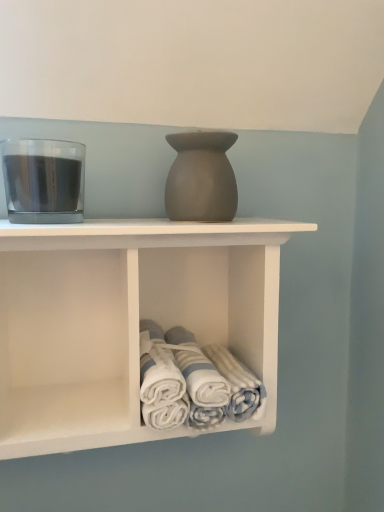
The image size is (384, 512). Describe the element at coordinates (201, 177) in the screenshot. I see `matte gray vase at center` at that location.

At what (x,y) coordinates should I click in order to perform the action: click on matte gray vase at center. Please return your answer as a coordinate pair (x, y). The image size is (384, 512). Looking at the image, I should click on (201, 177).

Measure the distance between transparent glass at left and camera.

A distance of 17.96 inches exists between transparent glass at left and camera.

The width and height of the screenshot is (384, 512). In order to click on matte gray vase at center in this screenshot , I will do `click(201, 177)`.

Are white matte towel rack at center and matte gray vase at center making contact?

They are not placed beside each other.

Is white matte towel rack at center outside of matte gray vase at center?

Yes.

Based on the photo, considering the sizes of white matte towel rack at center and matte gray vase at center in the image, is white matte towel rack at center wider or thinner than matte gray vase at center?

white matte towel rack at center is wider than matte gray vase at center.

From the picture: Is white matte towel rack at center in front of or behind matte gray vase at center in the image?

Visually, white matte towel rack at center is located in front of matte gray vase at center.

Considering the sizes of objects matte gray vase at center and transparent glass at left in the image provided, who is smaller, matte gray vase at center or transparent glass at left?

Smaller between the two is matte gray vase at center.

Between matte gray vase at center and transparent glass at left, which one has larger width?

Wider between the two is transparent glass at left.

Can you confirm if matte gray vase at center is positioned to the left of transparent glass at left?

No, matte gray vase at center is not to the left of transparent glass at left.

Considering the relative positions of white cotton towels at lower center and transparent glass at left in the image provided, is white cotton towels at lower center to the left or to the right of transparent glass at left?

Based on their positions, white cotton towels at lower center is located to the right of transparent glass at left.

In terms of height, does white cotton towels at lower center look taller or shorter compared to transparent glass at left?

In the image, white cotton towels at lower center appears to be shorter than transparent glass at left.

Is white cotton towels at lower center inside or outside of transparent glass at left?

white cotton towels at lower center is spatially situated outside transparent glass at left.

What's the angular difference between white cotton towels at lower center and matte gray vase at center's facing directions?

The angle between the facing direction of white cotton towels at lower center and the facing direction of matte gray vase at center is 1.5 degrees.

Is white cotton towels at lower center spatially inside matte gray vase at center, or outside of it?

The correct answer is: outside.

Is white cotton towels at lower center aimed at matte gray vase at center?

No, white cotton towels at lower center is not aimed at matte gray vase at center.

In the scene shown: From a real-world perspective, between white cotton towels at lower center and matte gray vase at center, who is vertically higher?

matte gray vase at center is physically above.

Looking at this image, could you tell me if white matte towel rack at center is facing transparent glass at left?

No, white matte towel rack at center does not turn towards transparent glass at left.

Find the location of a particular element. The image size is (384, 512). shelf in front of the transparent glass at left is located at coordinates (126, 321).

Which point is more forward, (274,314) or (58,186)?

Point (58,186)

Considering the sizes of objects white matte towel rack at center and transparent glass at left in the image provided, who is bigger, white matte towel rack at center or transparent glass at left?

Bigger between the two is white matte towel rack at center.

In terms of width, does transparent glass at left look wider or thinner when compared to white matte towel rack at center?

Clearly, transparent glass at left has less width compared to white matte towel rack at center.

From a real-world perspective, who is located higher, transparent glass at left or white matte towel rack at center?

transparent glass at left is physically above.

Looking at this image, can you confirm if transparent glass at left is shorter than white matte towel rack at center?

Indeed, transparent glass at left has a lesser height compared to white matte towel rack at center.

From the image's perspective, which is above, transparent glass at left or white matte towel rack at center?

From the image's view, transparent glass at left is above.

From the image's perspective, which one is positioned lower, matte gray vase at center or white cotton towels at lower center?

white cotton towels at lower center, from the image's perspective.

Is matte gray vase at center not near white cotton towels at lower center?

That's not correct — matte gray vase at center is a little close to white cotton towels at lower center.

Between matte gray vase at center and white cotton towels at lower center, which one appears on the right side from the viewer's perspective?

white cotton towels at lower center is more to the right.

Considering the sizes of matte gray vase at center and white cotton towels at lower center in the image, is matte gray vase at center wider or thinner than white cotton towels at lower center?

Clearly, matte gray vase at center has less width compared to white cotton towels at lower center.

Find the location of a particular element. Image resolution: width=384 pixels, height=512 pixels. shelf located below the matte gray vase at center (from the image's perspective) is located at coordinates (126, 321).

Locate an element on the screen. beverage located underneath the matte gray vase at center (from a real-world perspective) is located at coordinates (42, 183).

Looking at the image, which one is located further to white cotton towels at lower center, transparent glass at left or white matte towel rack at center?

Among the two, transparent glass at left is located further to white cotton towels at lower center.

Based on the photo, looking at the image, which one is located closer to white matte towel rack at center, white cotton towels at lower center or matte gray vase at center?

Based on the image, white cotton towels at lower center appears to be nearer to white matte towel rack at center.

Based on their spatial positions, is white matte towel rack at center or transparent glass at left closer to white cotton towels at lower center?

Based on the image, white matte towel rack at center appears to be nearer to white cotton towels at lower center.

From the image, which object appears to be nearer to white cotton towels at lower center, matte gray vase at center or transparent glass at left?

matte gray vase at center lies closer to white cotton towels at lower center than the other object.

Based on their spatial positions, is white cotton towels at lower center or matte gray vase at center further from transparent glass at left?

Among the two, white cotton towels at lower center is located further to transparent glass at left.

Looking at this image, which object lies nearer to the anchor point white matte towel rack at center, matte gray vase at center or transparent glass at left?

The object closer to white matte towel rack at center is matte gray vase at center.

Which object lies further to the anchor point matte gray vase at center, transparent glass at left or white matte towel rack at center?

Based on the image, white matte towel rack at center appears to be further to matte gray vase at center.

Estimate the real-world distances between objects in this image. Which object is further from matte gray vase at center, white matte towel rack at center or white cotton towels at lower center?

white cotton towels at lower center.

This screenshot has width=384, height=512. In order to click on beverage between matte gray vase at center and white cotton towels at lower center from top to bottom in this screenshot , I will do `click(42, 183)`.

Identify the location of shelf between transparent glass at left and white cotton towels at lower center in the vertical direction. (126, 321).

At what (x,y) coordinates should I click in order to perform the action: click on beverage between matte gray vase at center and white matte towel rack at center in the up-down direction. Please return your answer as a coordinate pair (x, y). This screenshot has width=384, height=512. Looking at the image, I should click on (x=42, y=183).

Locate an element on the screen. This screenshot has width=384, height=512. shelf between matte gray vase at center and white cotton towels at lower center from top to bottom is located at coordinates (126, 321).